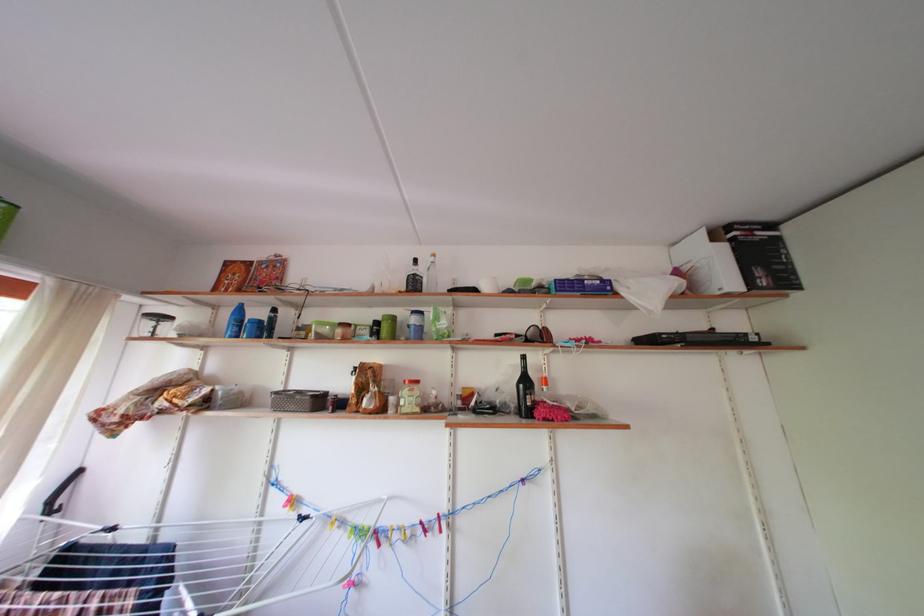
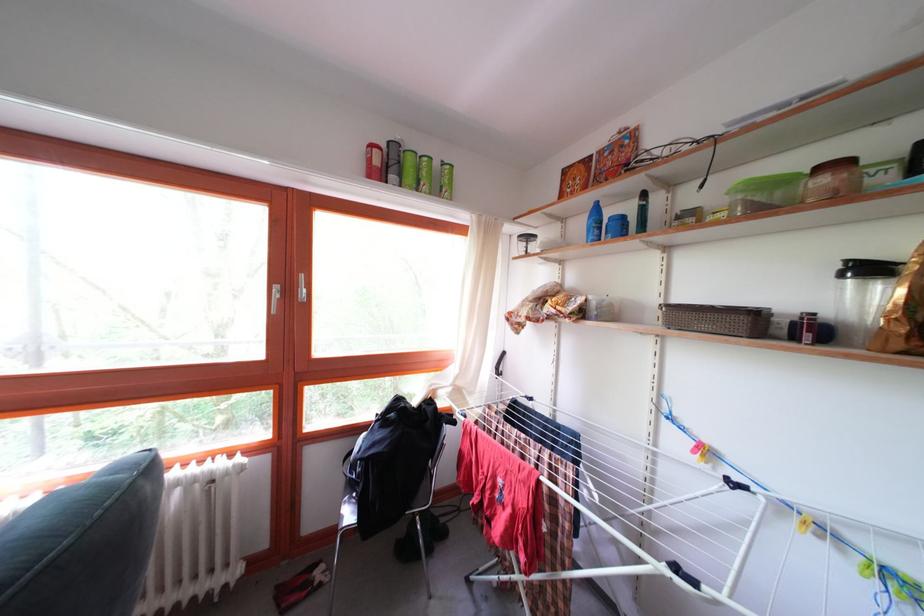
Find the pixel in the second image that matches point (242, 305) in the first image.

(598, 204)